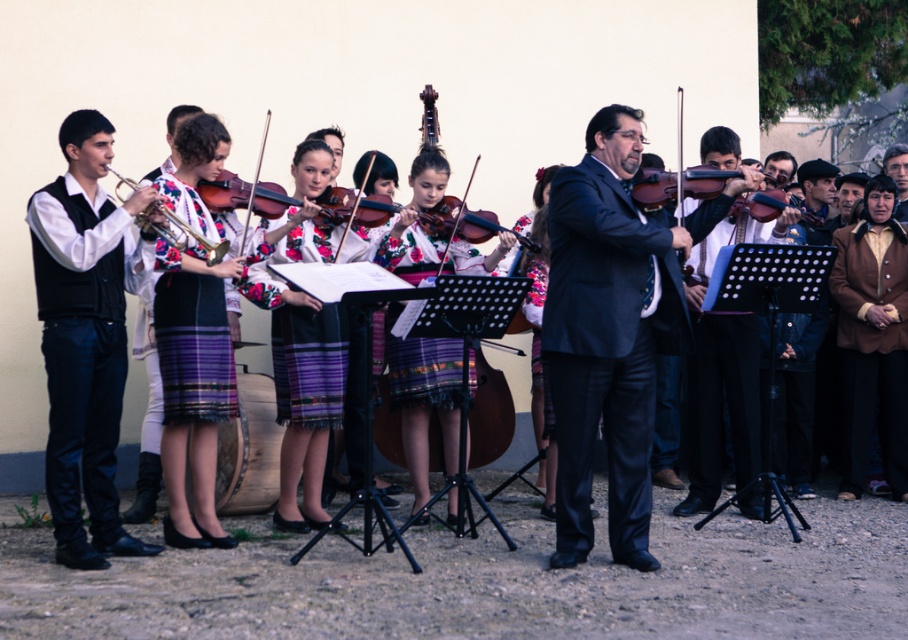
Question: Can you confirm if black denim pants at left is bigger than wooden violin at center?

Choices:
 (A) yes
 (B) no

Answer: (A)

Question: In this image, where is matte black suit at center located relative to matte wood violin at center?

Choices:
 (A) right
 (B) left

Answer: (B)

Question: Which point appears closest to the camera in this image?

Choices:
 (A) (174, 241)
 (B) (102, 225)
 (C) (504, 429)
 (D) (349, 227)

Answer: (B)

Question: Which object appears closest to the camera in this image?

Choices:
 (A) wooden polished cello at center
 (B) black denim pants at left

Answer: (B)

Question: Which point is closer to the camera taking this photo?

Choices:
 (A) (336, 170)
 (B) (489, 387)

Answer: (A)

Question: Is black denim pants at left below wooden polished cello at center?

Choices:
 (A) yes
 (B) no

Answer: (B)